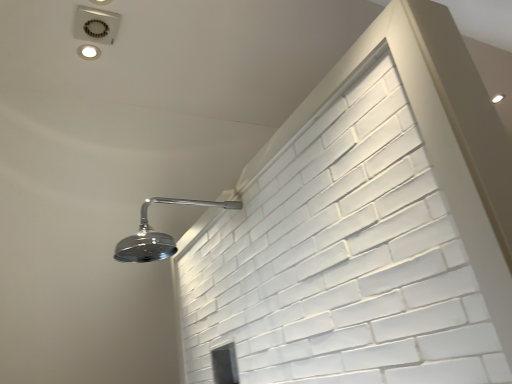
At what (x,y) coordinates should I click in order to perform the action: click on matte white droplight at upper left, placed as the second droplight when sorted from right to left. Please return your answer as a coordinate pair (x, y). Image resolution: width=512 pixels, height=384 pixels. Looking at the image, I should click on (89, 52).

What is the approximate width of chrome metallic shower head at upper left?

chrome metallic shower head at upper left is 56.48 centimeters wide.

You are a GUI agent. You are given a task and a screenshot of the screen. Output one action in this format:
    pyautogui.click(x=<x>, y=<y>)
    Task: Click on the matte silver droplight at upper right, marked as the 2th droplight in a front-to-back arrangement
    The width and height of the screenshot is (512, 384).
    Given the screenshot: What is the action you would take?
    pyautogui.click(x=498, y=98)

Identify the location of matte white droplight at upper left, the 1th droplight when ordered from left to right. (89, 52).

From a real-world perspective, is chrome metallic shower head at upper left below matte silver droplight at upper right, marked as the 2th droplight in a front-to-back arrangement?

Yes.

Based on their sizes in the image, would you say chrome metallic shower head at upper left is bigger or smaller than matte silver droplight at upper right, marked as the 2th droplight in a front-to-back arrangement?

Considering their sizes, chrome metallic shower head at upper left takes up more space than matte silver droplight at upper right, marked as the 2th droplight in a front-to-back arrangement.

Considering the sizes of chrome metallic shower head at upper left and matte silver droplight at upper right, which is the first droplight from right to left, in the image, is chrome metallic shower head at upper left wider or thinner than matte silver droplight at upper right, which is the first droplight from right to left,?

Considering their sizes, chrome metallic shower head at upper left looks broader than matte silver droplight at upper right, which is the first droplight from right to left.

Is chrome metallic shower head at upper left placed right next to matte silver droplight at upper right, positioned as the second droplight in left-to-right order?

No.

Is matte silver droplight at upper right, which is the first droplight from right to left, aimed at chrome metallic shower head at upper left?

No, matte silver droplight at upper right, which is the first droplight from right to left, is not facing towards chrome metallic shower head at upper left.

From the image's perspective, which one is positioned lower, matte silver droplight at upper right, marked as the 1th droplight in a back-to-front arrangement, or chrome metallic shower head at upper left?

chrome metallic shower head at upper left, from the image's perspective.

Is point (499, 93) less distant than point (161, 197)?

No, it is not.

Is matte silver droplight at upper right, which is the first droplight from right to left, not close to chrome metallic shower head at upper left?

Yes.

From the image's perspective, which one is positioned higher, chrome metallic shower head at upper left or matte white droplight at upper left, which ranks as the second droplight in back-to-front order?

From the image's view, matte white droplight at upper left, which ranks as the second droplight in back-to-front order, is above.

Are chrome metallic shower head at upper left and matte white droplight at upper left, which ranks as the second droplight in back-to-front order, making contact?

chrome metallic shower head at upper left and matte white droplight at upper left, which ranks as the second droplight in back-to-front order, are clearly separated.

Is chrome metallic shower head at upper left looking in the opposite direction of matte white droplight at upper left, placed as the second droplight when sorted from right to left?

That's not correct — chrome metallic shower head at upper left is not looking away from matte white droplight at upper left, placed as the second droplight when sorted from right to left.

Is matte white droplight at upper left, which ranks as the second droplight in back-to-front order, further to the viewer compared to chrome metallic shower head at upper left?

Yes, matte white droplight at upper left, which ranks as the second droplight in back-to-front order, is further from the camera.

Which of these two, matte white droplight at upper left, positioned as the 1th droplight in front-to-back order, or chrome metallic shower head at upper left, is thinner?

matte white droplight at upper left, positioned as the 1th droplight in front-to-back order.

From a real-world perspective, is matte white droplight at upper left, placed as the second droplight when sorted from right to left, positioned under chrome metallic shower head at upper left based on gravity?

No, from a real-world perspective, matte white droplight at upper left, placed as the second droplight when sorted from right to left, is not below chrome metallic shower head at upper left.

How many degrees apart are the facing directions of matte white droplight at upper left, placed as the second droplight when sorted from right to left, and chrome metallic shower head at upper left?

They differ by 179 degrees in their facing directions.

From the image's perspective, which is below, matte white droplight at upper left, positioned as the 1th droplight in front-to-back order, or matte silver droplight at upper right, which is the first droplight from right to left?

matte white droplight at upper left, positioned as the 1th droplight in front-to-back order.

Could matte silver droplight at upper right, which is the first droplight from right to left, be considered to be inside matte white droplight at upper left, placed as the second droplight when sorted from right to left?

That's incorrect, matte silver droplight at upper right, which is the first droplight from right to left, is not inside matte white droplight at upper left, placed as the second droplight when sorted from right to left.

Is matte white droplight at upper left, positioned as the 1th droplight in front-to-back order, oriented towards matte silver droplight at upper right, positioned as the second droplight in left-to-right order?

Yes, matte white droplight at upper left, positioned as the 1th droplight in front-to-back order, is turned towards matte silver droplight at upper right, positioned as the second droplight in left-to-right order.

Can you confirm if matte white droplight at upper left, the 1th droplight when ordered from left to right, is wider than matte silver droplight at upper right, marked as the 2th droplight in a front-to-back arrangement?

No, matte white droplight at upper left, the 1th droplight when ordered from left to right, is not wider than matte silver droplight at upper right, marked as the 2th droplight in a front-to-back arrangement.

What's the angular difference between matte silver droplight at upper right, which is the first droplight from right to left, and matte white droplight at upper left, which ranks as the second droplight in back-to-front order,'s facing directions?

0.00191 degrees separate the facing orientations of matte silver droplight at upper right, which is the first droplight from right to left, and matte white droplight at upper left, which ranks as the second droplight in back-to-front order.

Between point (496, 94) and point (79, 49), which one is positioned in front?

The point (79, 49) is closer.

Based on the photo, considering the sizes of objects matte silver droplight at upper right, marked as the 1th droplight in a back-to-front arrangement, and matte white droplight at upper left, the 1th droplight when ordered from left to right, in the image provided, who is taller, matte silver droplight at upper right, marked as the 1th droplight in a back-to-front arrangement, or matte white droplight at upper left, the 1th droplight when ordered from left to right,?

Standing taller between the two is matte white droplight at upper left, the 1th droplight when ordered from left to right.

Does matte silver droplight at upper right, marked as the 1th droplight in a back-to-front arrangement, have a larger size compared to matte white droplight at upper left, positioned as the 1th droplight in front-to-back order?

Yes, matte silver droplight at upper right, marked as the 1th droplight in a back-to-front arrangement, is bigger than matte white droplight at upper left, positioned as the 1th droplight in front-to-back order.

There is a chrome metallic shower head at upper left. Identify the location of the 2nd droplight above it (from the image's perspective). (498, 98).

This screenshot has width=512, height=384. There is a chrome metallic shower head at upper left. In order to click on the 2nd droplight above it (from a real-world perspective) in this screenshot , I will do `click(498, 98)`.

When comparing their distances from chrome metallic shower head at upper left, does matte white droplight at upper left, placed as the second droplight when sorted from right to left, or matte silver droplight at upper right, positioned as the second droplight in left-to-right order, seem closer?

matte white droplight at upper left, placed as the second droplight when sorted from right to left, is positioned closer to the anchor chrome metallic shower head at upper left.

Considering their positions, is matte silver droplight at upper right, positioned as the second droplight in left-to-right order, positioned closer to chrome metallic shower head at upper left than matte white droplight at upper left, which ranks as the second droplight in back-to-front order?

matte white droplight at upper left, which ranks as the second droplight in back-to-front order, is positioned closer to the anchor chrome metallic shower head at upper left.

When comparing their distances from matte white droplight at upper left, positioned as the 1th droplight in front-to-back order, does chrome metallic shower head at upper left or matte silver droplight at upper right, positioned as the second droplight in left-to-right order, seem closer?

chrome metallic shower head at upper left is positioned closer to the anchor matte white droplight at upper left, positioned as the 1th droplight in front-to-back order.

From the image, which object appears to be farther from matte white droplight at upper left, positioned as the 1th droplight in front-to-back order, matte silver droplight at upper right, positioned as the second droplight in left-to-right order, or chrome metallic shower head at upper left?

matte silver droplight at upper right, positioned as the second droplight in left-to-right order.

Which object lies further to the anchor point matte silver droplight at upper right, marked as the 2th droplight in a front-to-back arrangement, chrome metallic shower head at upper left or matte white droplight at upper left, placed as the second droplight when sorted from right to left?

matte white droplight at upper left, placed as the second droplight when sorted from right to left.

Which object lies further to the anchor point matte silver droplight at upper right, marked as the 1th droplight in a back-to-front arrangement, matte white droplight at upper left, the 1th droplight when ordered from left to right, or chrome metallic shower head at upper left?

Among the two, matte white droplight at upper left, the 1th droplight when ordered from left to right, is located further to matte silver droplight at upper right, marked as the 1th droplight in a back-to-front arrangement.

Identify the location of shower situated between matte white droplight at upper left, placed as the second droplight when sorted from right to left, and matte silver droplight at upper right, positioned as the second droplight in left-to-right order, from left to right. Image resolution: width=512 pixels, height=384 pixels. tap(158, 233).